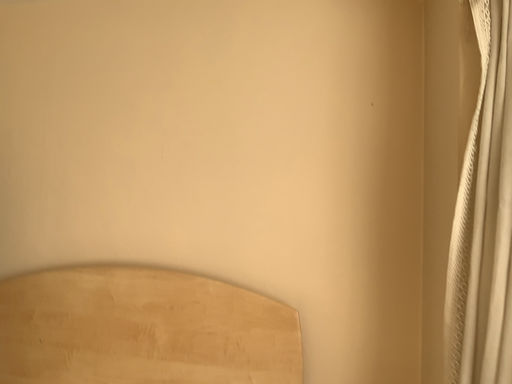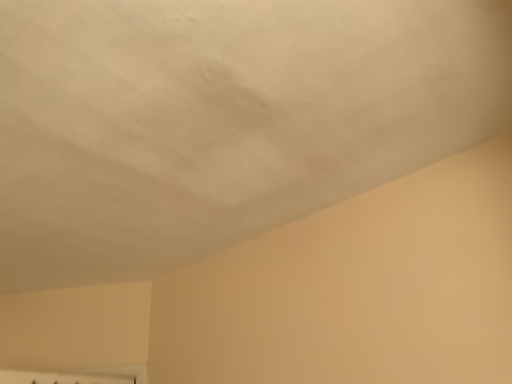
Question: Which way did the camera rotate in the video?

Choices:
 (A) rotated left
 (B) rotated right

Answer: (A)